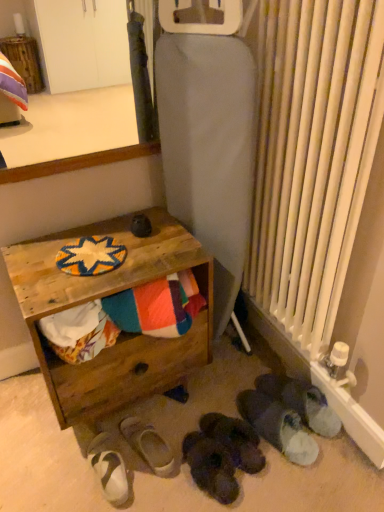
Describe the element at coordinates (235, 440) in the screenshot. I see `black suede slippers at lower center, positioned as the 3th footwear in right-to-left order` at that location.

In order to click on white suede sandals at lower left, which appears as the 6th footwear when viewed from the right in this screenshot , I will do `click(109, 469)`.

Identify the location of dark gray fabric slippers at lower right, acting as the 6th footwear starting from the left. The width and height of the screenshot is (384, 512). (302, 402).

What is the approximate width of dark gray fabric slippers at lower right, the first footwear in the right-to-left sequence?

The width of dark gray fabric slippers at lower right, the first footwear in the right-to-left sequence, is 12.72 inches.

Measure the distance between wooden crate at lower left and camera.

A distance of 3.66 feet exists between wooden crate at lower left and camera.

Identify the location of dark gray suede slippers at lower center, the third footwear in the left-to-right sequence. The image size is (384, 512). (210, 467).

How different are the orientations of multicolored fabric at lower left and white suede sandals at lower left, which ranks as the 1th footwear in left-to-right order, in degrees?

multicolored fabric at lower left and white suede sandals at lower left, which ranks as the 1th footwear in left-to-right order, are facing 0.623 degrees away from each other.

Is multicolored fabric at lower left oriented towards white suede sandals at lower left, which appears as the 6th footwear when viewed from the right?

No, multicolored fabric at lower left is not turned towards white suede sandals at lower left, which appears as the 6th footwear when viewed from the right.

In the scene shown: From the image's perspective, is multicolored fabric at lower left located above or below white suede sandals at lower left, which appears as the 6th footwear when viewed from the right?

Answer: multicolored fabric at lower left is above white suede sandals at lower left, which appears as the 6th footwear when viewed from the right.

In the scene shown: Considering the relative sizes of multicolored fabric at lower left and white suede sandals at lower left, which ranks as the 1th footwear in left-to-right order, in the image provided, is multicolored fabric at lower left taller than white suede sandals at lower left, which ranks as the 1th footwear in left-to-right order,?

Indeed, multicolored fabric at lower left has a greater height compared to white suede sandals at lower left, which ranks as the 1th footwear in left-to-right order.

Is white fabric slipper at lower center, the 2th footwear in the left-to-right sequence, in front of or behind white metal radiator at right in the image?

white fabric slipper at lower center, the 2th footwear in the left-to-right sequence, is behind white metal radiator at right.

From the image's perspective, is white fabric slipper at lower center, which appears as the fifth footwear when viewed from the right, on top of white metal radiator at right?

Actually, white fabric slipper at lower center, which appears as the fifth footwear when viewed from the right, appears below white metal radiator at right in the image.

From a real-world perspective, between white fabric slipper at lower center, which appears as the fifth footwear when viewed from the right, and white metal radiator at right, who is vertically lower?

From a 3D spatial view, white fabric slipper at lower center, which appears as the fifth footwear when viewed from the right, is below.

Considering the sizes of objects white fabric slipper at lower center, which appears as the fifth footwear when viewed from the right, and white metal radiator at right in the image provided, who is taller, white fabric slipper at lower center, which appears as the fifth footwear when viewed from the right, or white metal radiator at right?

white metal radiator at right is taller.

At what (x,y) coordinates should I click in order to perform the action: click on table located on the left of dark gray suede slippers at lower center, the 4th footwear viewed from the right. Please return your answer as a coordinate pair (x, y). The image size is (384, 512). Looking at the image, I should click on (107, 295).

Is dark gray suede slippers at lower center, the 4th footwear viewed from the right, behind wooden crate at lower left?

Yes, dark gray suede slippers at lower center, the 4th footwear viewed from the right, is further from the camera.

Can you confirm if dark gray suede slippers at lower center, the third footwear in the left-to-right sequence, is positioned to the right of wooden crate at lower left?

Correct, you'll find dark gray suede slippers at lower center, the third footwear in the left-to-right sequence, to the right of wooden crate at lower left.

Does dark gray suede slippers at lower center, the third footwear in the left-to-right sequence, turn towards wooden crate at lower left?

No, dark gray suede slippers at lower center, the third footwear in the left-to-right sequence, is not turned towards wooden crate at lower left.

Considering the relative sizes of white fabric slipper at lower center, which appears as the fifth footwear when viewed from the right, and white fuzzy slippers at lower right, which is the second footwear from right to left, in the image provided, is white fabric slipper at lower center, which appears as the fifth footwear when viewed from the right, thinner than white fuzzy slippers at lower right, which is the second footwear from right to left,?

Indeed, white fabric slipper at lower center, which appears as the fifth footwear when viewed from the right, has a lesser width compared to white fuzzy slippers at lower right, which is the second footwear from right to left.

Can you tell me how much white fabric slipper at lower center, which appears as the fifth footwear when viewed from the right, and white fuzzy slippers at lower right, which is the second footwear from right to left, differ in facing direction?

The angle between the facing direction of white fabric slipper at lower center, which appears as the fifth footwear when viewed from the right, and the facing direction of white fuzzy slippers at lower right, which is the second footwear from right to left, is 0.147 degrees.

Does white fabric slipper at lower center, which appears as the fifth footwear when viewed from the right, contain white fuzzy slippers at lower right, which is the second footwear from right to left?

No, white fuzzy slippers at lower right, which is the second footwear from right to left, is not a part of white fabric slipper at lower center, which appears as the fifth footwear when viewed from the right.

Between white fabric slipper at lower center, the 2th footwear in the left-to-right sequence, and black suede slippers at lower center, acting as the 4th footwear starting from the left, which one has smaller size?

white fabric slipper at lower center, the 2th footwear in the left-to-right sequence, is smaller.

Is black suede slippers at lower center, acting as the 4th footwear starting from the left, completely or partially inside white fabric slipper at lower center, which appears as the fifth footwear when viewed from the right?

No, black suede slippers at lower center, acting as the 4th footwear starting from the left, is not a part of white fabric slipper at lower center, which appears as the fifth footwear when viewed from the right.

Looking at this image, is white fabric slipper at lower center, the 2th footwear in the left-to-right sequence, touching black suede slippers at lower center, positioned as the 3th footwear in right-to-left order?

There is a gap between white fabric slipper at lower center, the 2th footwear in the left-to-right sequence, and black suede slippers at lower center, positioned as the 3th footwear in right-to-left order.

From the image's perspective, which object appears higher, white fabric slipper at lower center, the 2th footwear in the left-to-right sequence, or black suede slippers at lower center, acting as the 4th footwear starting from the left?

black suede slippers at lower center, acting as the 4th footwear starting from the left.

Is there a large distance between dark gray suede slippers at lower center, the third footwear in the left-to-right sequence, and white metal radiator at right?

No, there isn't a large distance between dark gray suede slippers at lower center, the third footwear in the left-to-right sequence, and white metal radiator at right.

The height and width of the screenshot is (512, 384). I want to click on radiator that is in front of the dark gray suede slippers at lower center, the 4th footwear viewed from the right, so click(313, 155).

Is dark gray suede slippers at lower center, the 4th footwear viewed from the right, to the left of white metal radiator at right from the viewer's perspective?

Yes, dark gray suede slippers at lower center, the 4th footwear viewed from the right, is to the left of white metal radiator at right.

Is point (185, 436) farther from viewer compared to point (285, 295)?

No, (185, 436) is in front of (285, 295).

Does black suede slippers at lower center, acting as the 4th footwear starting from the left, appear on the right side of dark gray suede slippers at lower center, the third footwear in the left-to-right sequence?

Correct, you'll find black suede slippers at lower center, acting as the 4th footwear starting from the left, to the right of dark gray suede slippers at lower center, the third footwear in the left-to-right sequence.

Between point (231, 443) and point (203, 461), which one is positioned in front?

The point (203, 461) is closer.

Considering the relative sizes of black suede slippers at lower center, positioned as the 3th footwear in right-to-left order, and dark gray suede slippers at lower center, the 4th footwear viewed from the right, in the image provided, is black suede slippers at lower center, positioned as the 3th footwear in right-to-left order, bigger than dark gray suede slippers at lower center, the 4th footwear viewed from the right,?

Correct, black suede slippers at lower center, positioned as the 3th footwear in right-to-left order, is larger in size than dark gray suede slippers at lower center, the 4th footwear viewed from the right.

Locate an element on the screen. Image resolution: width=384 pixels, height=512 pixels. footwear that is the 2nd object located below the black suede slippers at lower center, acting as the 4th footwear starting from the left (from the image's perspective) is located at coordinates (210, 467).

From the multicolored fabric at lower left, count the 2nd footwear to the left and point to it. Please provide its 2D coordinates.

[(109, 469)]

There is a white metal radiator at right. Where is `the 4th footwear below it (from the image's perspective)`? The image size is (384, 512). the 4th footwear below it (from the image's perspective) is located at coordinates (148, 445).

Based on their spatial positions, is white fabric slipper at lower center, the 2th footwear in the left-to-right sequence, or white suede sandals at lower left, which appears as the 6th footwear when viewed from the right, closer to black suede slippers at lower center, positioned as the 3th footwear in right-to-left order?

white fabric slipper at lower center, the 2th footwear in the left-to-right sequence.

Based on their spatial positions, is white fuzzy slippers at lower right, placed as the 5th footwear when sorted from left to right, or white metal radiator at right closer to black suede slippers at lower center, acting as the 4th footwear starting from the left?

white fuzzy slippers at lower right, placed as the 5th footwear when sorted from left to right.

Based on the photo, estimate the real-world distances between objects in this image. Which object is closer to white fuzzy slippers at lower right, placed as the 5th footwear when sorted from left to right, white fabric slipper at lower center, which appears as the fifth footwear when viewed from the right, or wooden crate at lower left?

white fabric slipper at lower center, which appears as the fifth footwear when viewed from the right, is closer to white fuzzy slippers at lower right, placed as the 5th footwear when sorted from left to right.

Looking at the image, which one is located further to wooden surface at upper left, multicolored fabric at lower left or white suede sandals at lower left, which ranks as the 1th footwear in left-to-right order?

Among the two, white suede sandals at lower left, which ranks as the 1th footwear in left-to-right order, is located further to wooden surface at upper left.

From the picture: Based on their spatial positions, is wooden surface at upper left or dark gray fabric slippers at lower right, acting as the 6th footwear starting from the left, closer to multicolored fabric at lower left?

wooden surface at upper left.

From the image, which object appears to be farther from multicolored fabric at lower left, white suede sandals at lower left, which appears as the 6th footwear when viewed from the right, or dark gray suede slippers at lower center, the 4th footwear viewed from the right?

Based on the image, dark gray suede slippers at lower center, the 4th footwear viewed from the right, appears to be further to multicolored fabric at lower left.

Considering their positions, is white fuzzy slippers at lower right, which is the second footwear from right to left, positioned closer to wooden surface at upper left than white metal radiator at right?

Based on the image, white metal radiator at right appears to be nearer to wooden surface at upper left.

When comparing their distances from wooden surface at upper left, does wooden crate at lower left or multicolored fabric at lower left seem further?

multicolored fabric at lower left lies further to wooden surface at upper left than the other object.

I want to click on footwear located between white fabric slipper at lower center, the 2th footwear in the left-to-right sequence, and black suede slippers at lower center, acting as the 4th footwear starting from the left, in the left-right direction, so click(210, 467).

Identify the location of footwear between wooden surface at upper left and white fuzzy slippers at lower right, which is the second footwear from right to left, from top to bottom. (302, 402).

Locate an element on the screen. This screenshot has height=512, width=384. table between wooden surface at upper left and dark gray suede slippers at lower center, the third footwear in the left-to-right sequence, vertically is located at coordinates (107, 295).

This screenshot has width=384, height=512. I want to click on footwear between dark gray suede slippers at lower center, the third footwear in the left-to-right sequence, and white fuzzy slippers at lower right, placed as the 5th footwear when sorted from left to right, so click(235, 440).